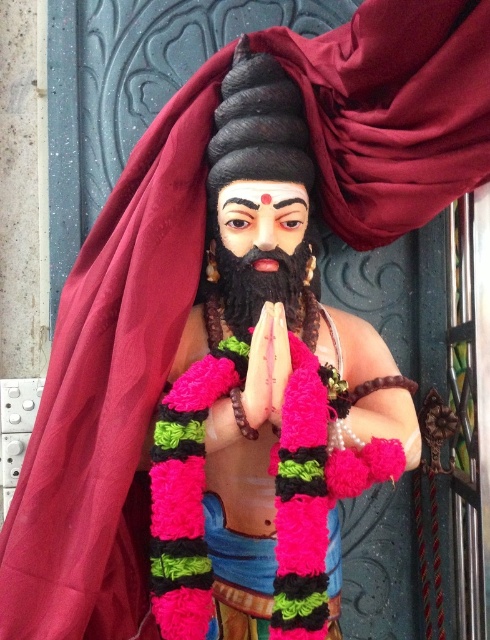
Question: Which point is farther to the camera?

Choices:
 (A) (220, 316)
 (B) (304, 124)

Answer: (A)

Question: Does polished wood statue at center appear on the left side of black matte beard at center?

Choices:
 (A) yes
 (B) no

Answer: (B)

Question: Does polished wood statue at center have a larger size compared to black matte beard at center?

Choices:
 (A) no
 (B) yes

Answer: (B)

Question: Can you confirm if polished wood statue at center is positioned to the right of black matte beard at center?

Choices:
 (A) no
 (B) yes

Answer: (B)

Question: Which object appears closest to the camera in this image?

Choices:
 (A) polished wood statue at center
 (B) black matte beard at center

Answer: (A)